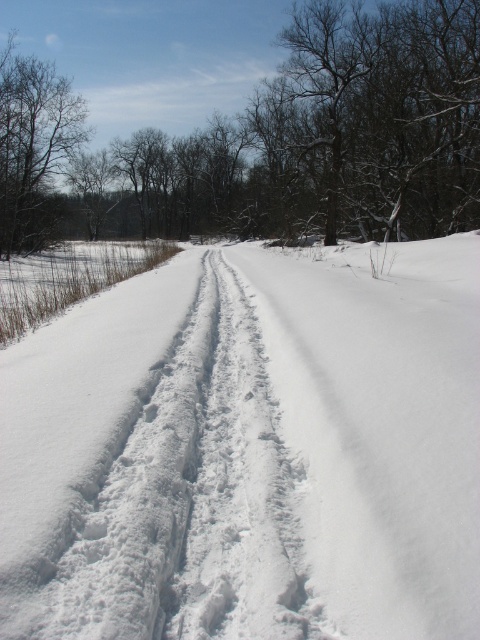
You are standing at the edge of the snow path in the winter forest scene. You see a point marked at coordinates (250,451). What is located at that point?

The point at coordinates (250,451) indicates white fluffy snow at center.

You are an observer standing at the end of the snow path looking towards the forest. You see two trees in the scene. Which tree, the brown textured tree at upper center or the brown textured tree at left, appears bigger in size?

The brown textured tree at upper center appears bigger in size compared to the brown textured tree at left.